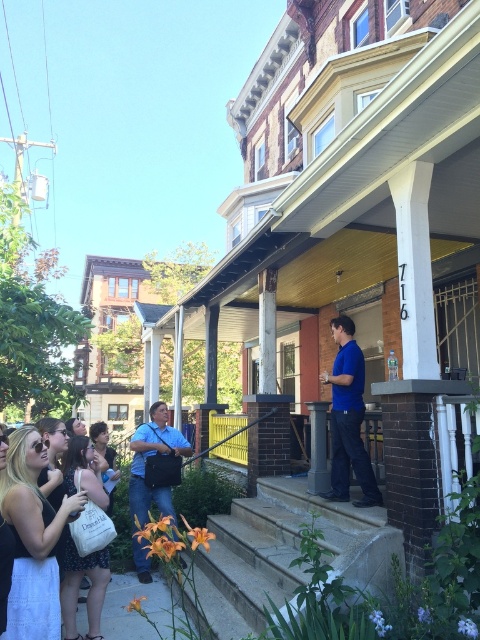
Based on the photo, who is lower down, blue fabric bag at lower left or smooth gray column at center?

blue fabric bag at lower left is lower down.

Is blue fabric bag at lower left closer to the viewer compared to smooth gray column at center?

Yes, it is.

Is point (166, 513) positioned in front of point (320, 412)?

No, (166, 513) is behind (320, 412).

At what (x,y) coordinates should I click in order to perform the action: click on blue fabric bag at lower left. Please return your answer as a coordinate pair (x, y). The image size is (480, 640). Looking at the image, I should click on tap(149, 458).

Between concrete stairs at center and white cotton dress at lower left, which one appears on the left side from the viewer's perspective?

white cotton dress at lower left is more to the left.

Is point (262, 584) closer to camera compared to point (23, 570)?

No, (262, 584) is further to viewer.

The height and width of the screenshot is (640, 480). Find the location of `concrete stairs at center`. concrete stairs at center is located at coordinates (285, 552).

Can you confirm if white cotton dress at lower left is positioned above blue smooth shirt at center?

Incorrect, white cotton dress at lower left is not positioned above blue smooth shirt at center.

Does point (41, 440) come behind point (351, 419)?

No, it is not.

Which is in front, point (38, 605) or point (360, 352)?

Point (38, 605) is in front.

You are a GUI agent. You are given a task and a screenshot of the screen. Output one action in this format:
    pyautogui.click(x=<x>, y=<y>)
    Task: Click on the white cotton dress at lower left
    
    Given the screenshot: What is the action you would take?
    pyautogui.click(x=33, y=538)